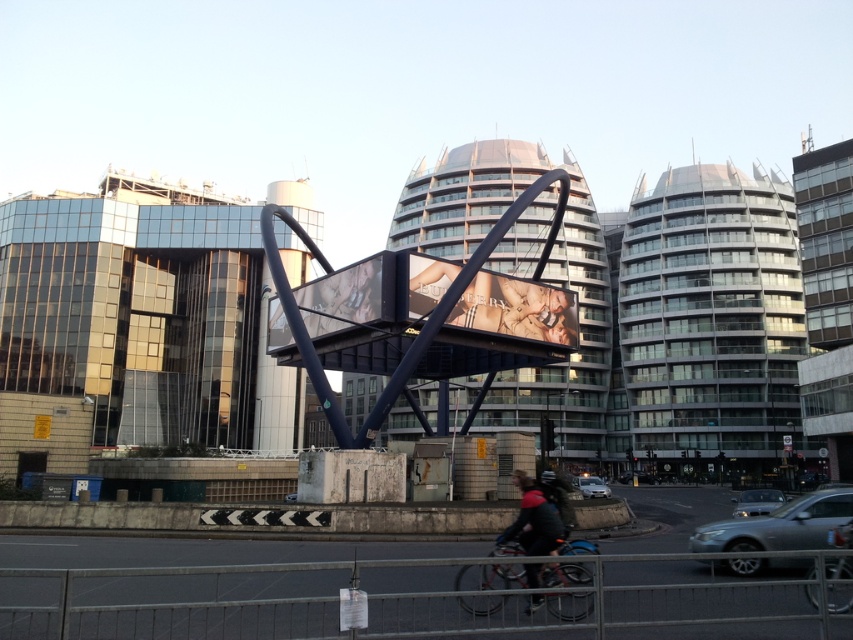
Question: Does dark gray jacket at lower center lie behind silver metallic car at lower right?

Choices:
 (A) no
 (B) yes

Answer: (A)

Question: Which point is closer to the camera taking this photo?

Choices:
 (A) (833, 513)
 (B) (839, 605)

Answer: (B)

Question: Does matte silver billboard at center come behind shiny metallic bicycle at lower center?

Choices:
 (A) yes
 (B) no

Answer: (A)

Question: Can you confirm if matte silver billboard at center is thinner than shiny metallic bicycle at lower center?

Choices:
 (A) yes
 (B) no

Answer: (B)

Question: Among these objects, which one is nearest to the camera?

Choices:
 (A) silver metallic sedan at lower right
 (B) metallic silver car at lower right

Answer: (A)

Question: Estimate the real-world distances between objects in this image. Which object is farther from the dark gray jacket at lower center?

Choices:
 (A) shiny metallic bicycle at lower center
 (B) metallic silver car at lower right
 (C) silver metallic sedan at lower right

Answer: (B)